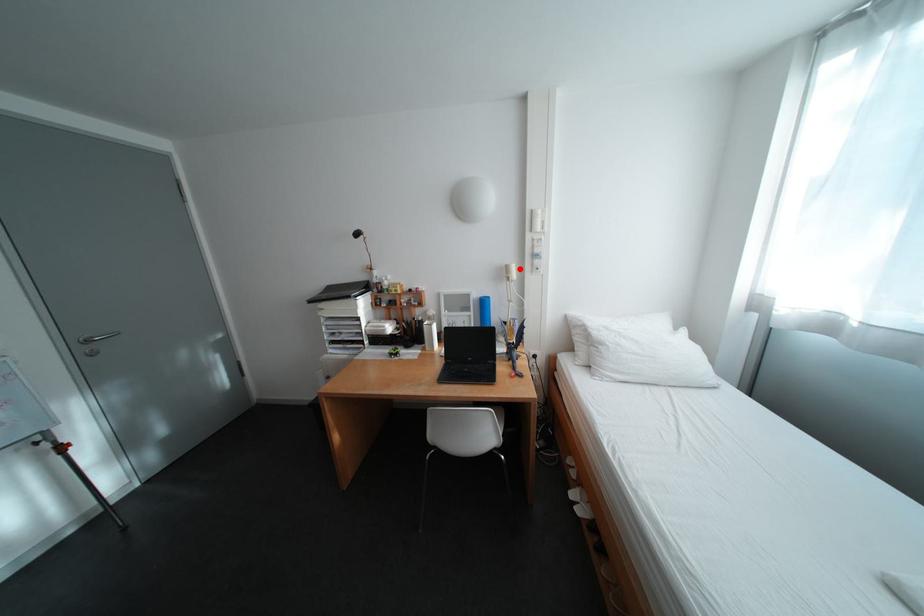
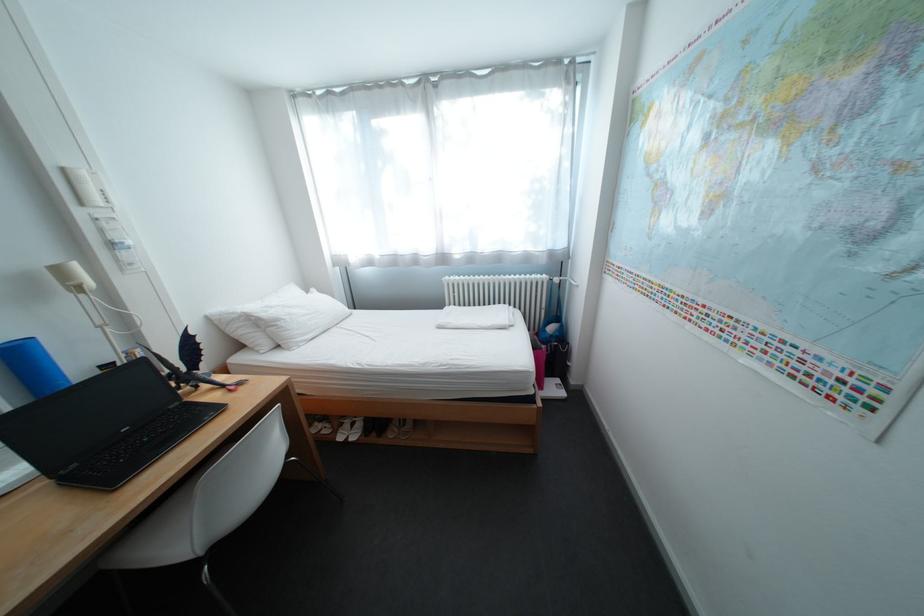
Question: A red point is marked in image1. In image2, is the corresponding 3D point closer to the camera or farther? Reply with the corresponding letter.

Choices:
 (A) The corresponding 3D point is closer.
 (B) The corresponding 3D point is farther.

Answer: (B)